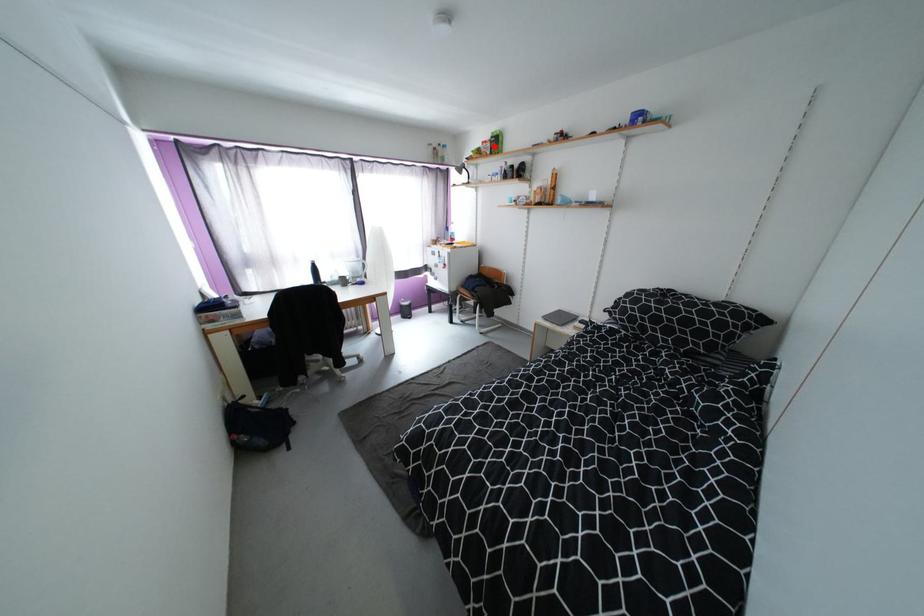
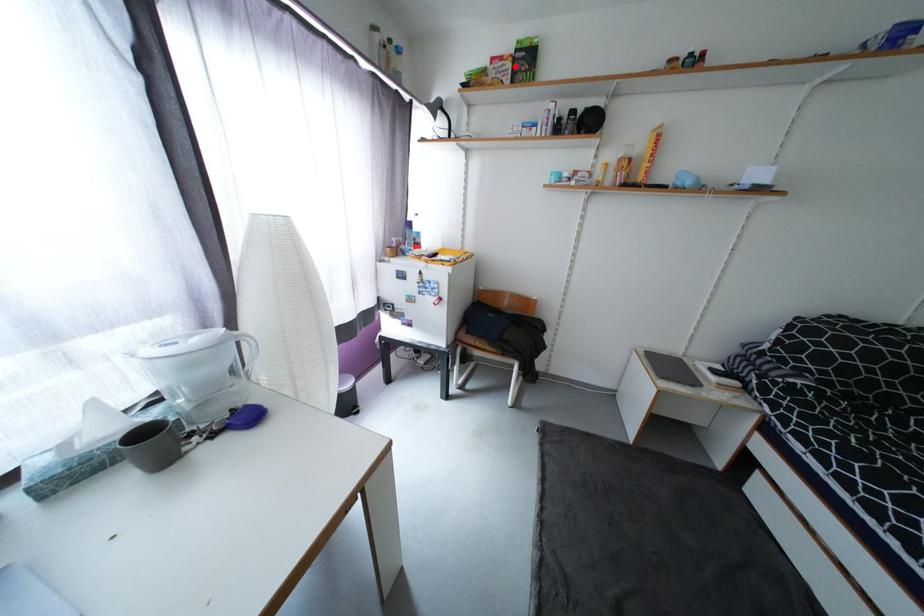
I am providing you with two images of the same scene from different viewpoints. A red point is marked on the first image and another point is marked on the second image. Does the point marked in image1 correspond to the same location as the one in image2?

Yes